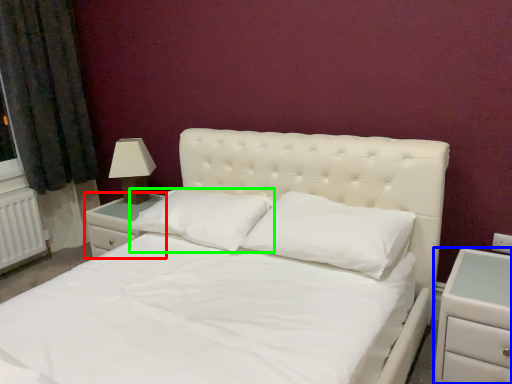
Question: Which is nearer to the nightstand (highlighted by a red box)? nightstand (highlighted by a blue box) or pillow (highlighted by a green box).

Choices:
 (A) nightstand
 (B) pillow

Answer: (B)